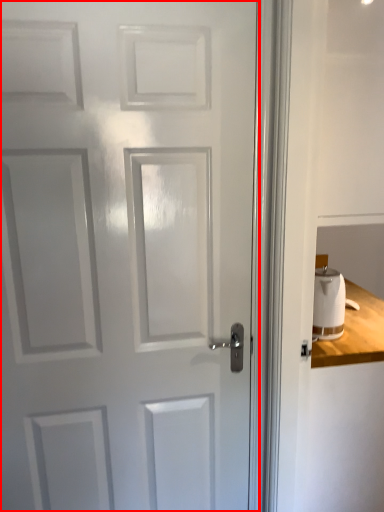
Question: From the image, what is the correct spatial relationship of door (annotated by the red box) in relation to toilet paper?

Choices:
 (A) right
 (B) left

Answer: (B)